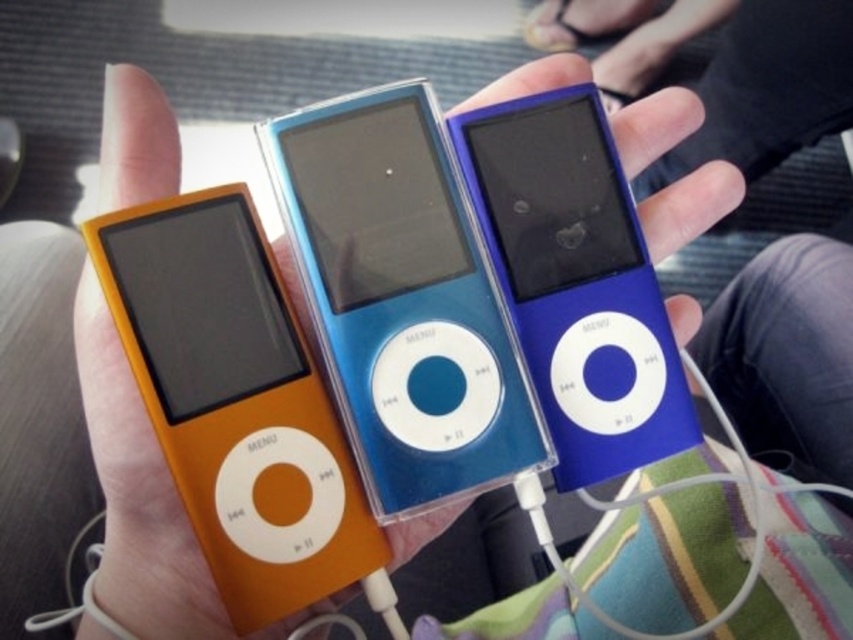
Is orange matte ipod at left closer to the viewer compared to blue glossy ipod at center?

Yes, orange matte ipod at left is closer to the viewer.

What do you see at coordinates (236, 403) in the screenshot? I see `orange matte ipod at left` at bounding box center [236, 403].

What are the coordinates of `orange matte ipod at left` in the screenshot? It's located at (236, 403).

Does orange glossy ipod at center have a greater width compared to blue glossy ipod at center?

Yes, orange glossy ipod at center is wider than blue glossy ipod at center.

Which is behind, point (152, 90) or point (473, 193)?

The point (473, 193) is behind.

At what (x,y) coordinates should I click in order to perform the action: click on orange glossy ipod at center. Please return your answer as a coordinate pair (x, y). The image size is (853, 640). Looking at the image, I should click on (144, 500).

Does matte blue ipod at center appear over orange glossy ipod at center?

No.

Does point (456, 464) come in front of point (86, 371)?

Yes, point (456, 464) is in front of point (86, 371).

Measure the distance between matte blue ipod at center and camera.

16.92 inches

Find the location of `matte blue ipod at center`. matte blue ipod at center is located at coordinates (402, 298).